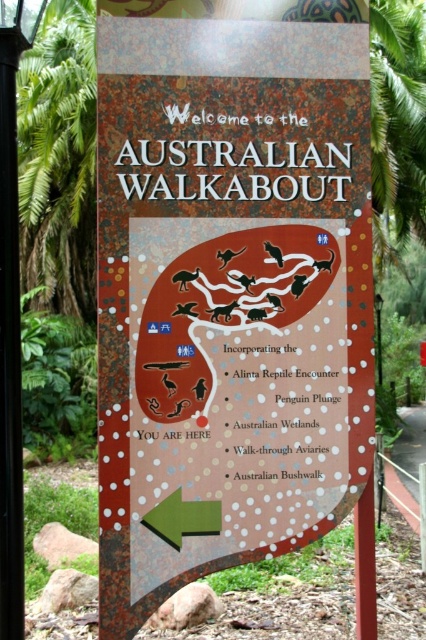
Question: Which of the following is the farthest from the observer?

Choices:
 (A) (9, 534)
 (B) (112, 454)

Answer: (B)

Question: Is rustic wooden sign at center wider than black metal pole at left?

Choices:
 (A) yes
 (B) no

Answer: (A)

Question: Which object appears farthest from the camera in this image?

Choices:
 (A) black metal pole at left
 (B) rustic wooden sign at center

Answer: (B)

Question: In this image, where is rustic wooden sign at center located relative to black metal pole at left?

Choices:
 (A) above
 (B) below

Answer: (B)

Question: Is rustic wooden sign at center above black metal pole at left?

Choices:
 (A) no
 (B) yes

Answer: (A)